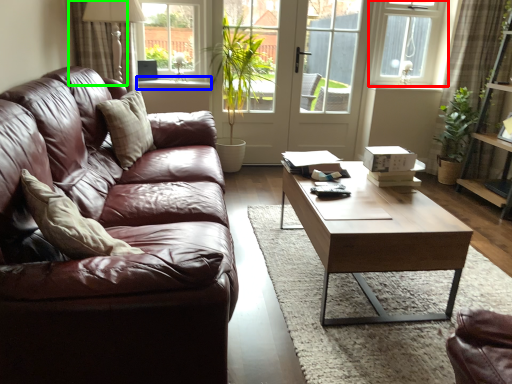
Question: Estimate the real-world distances between objects in this image. Which object is closer to window (highlighted by a red box), window sill (highlighted by a blue box) or curtain (highlighted by a green box)?

Choices:
 (A) window sill
 (B) curtain

Answer: (A)